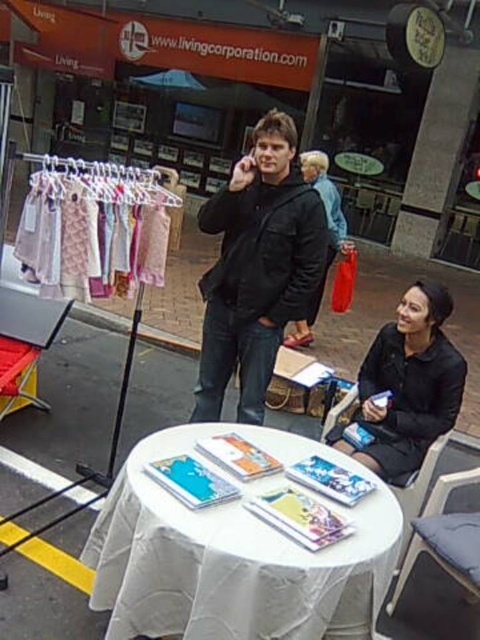
You are a customer at this outdoor event and want to buy a jacket that is easier to fold and store. Which jacket between the black matte jacket at center and the matte black jacket at center would you choose?

The black matte jacket at center is thinner than the matte black jacket at center, so it would be easier to fold and store.

What is located at the point with coordinates (408, 385)?

The black matte dress at lower right is located at point (408, 385).